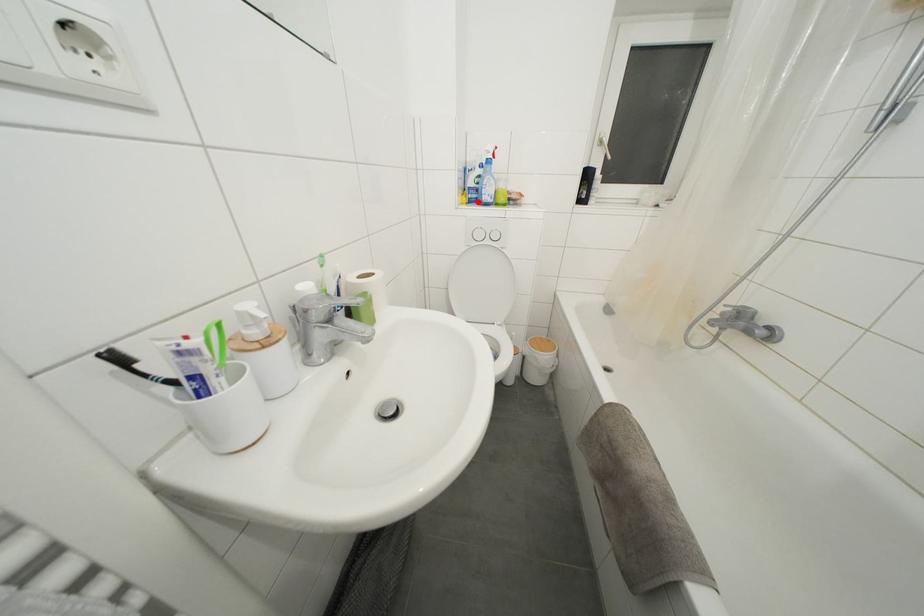
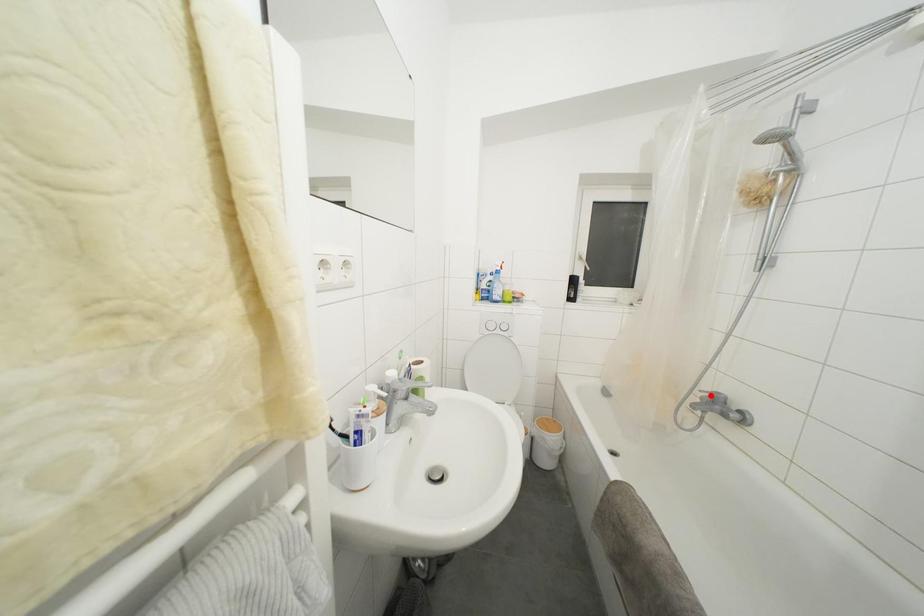
From the picture: I am providing you with two images of the same scene from different viewpoints. A red point is marked on the first image and another point is marked on the second image. Is the red point in image1 aligned with the point shown in image2?

No